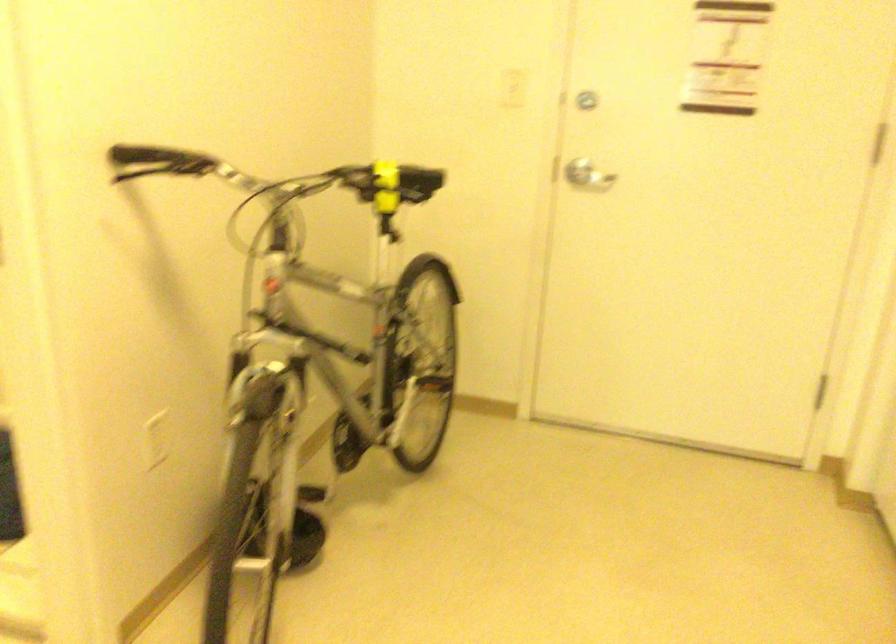
The height and width of the screenshot is (644, 896). What are the coordinates of `silver door lock` in the screenshot? It's located at (586, 100).